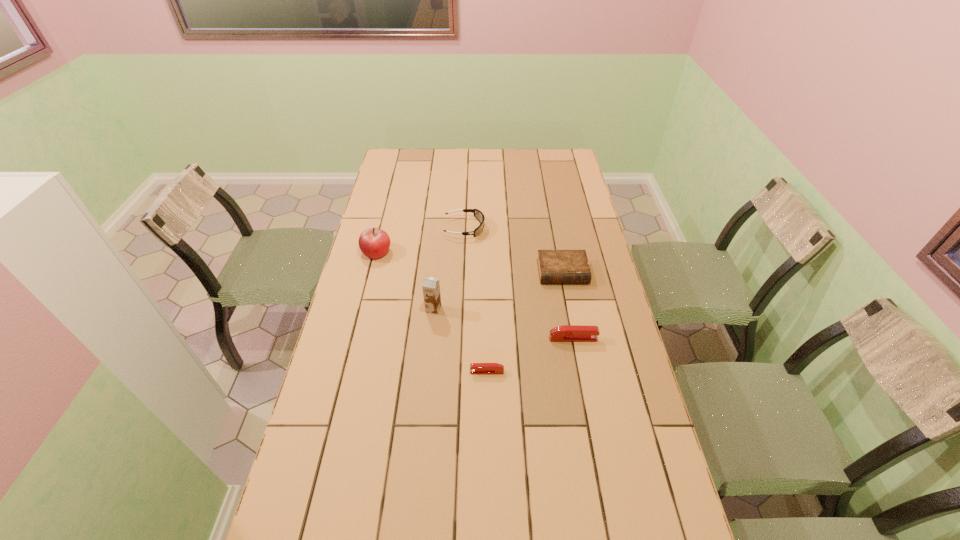
Image resolution: width=960 pixels, height=540 pixels. Find the location of `free space located 0.110m on the front-facing side of the nearer stapler`. free space located 0.110m on the front-facing side of the nearer stapler is located at coordinates coord(433,372).

The width and height of the screenshot is (960, 540). I want to click on vacant region located on the front-facing side of the nearer stapler, so click(399, 372).

The image size is (960, 540). Find the location of `free region located on the front-facing side of the nearer stapler`. free region located on the front-facing side of the nearer stapler is located at coordinates (444, 372).

Identify the location of free space located on the front-facing side of the farther stapler. (625, 339).

I want to click on blank space located 0.360m on the front and sides of the goggles, so click(573, 228).

Locate an element on the screen. The width and height of the screenshot is (960, 540). vacant space positioned 0.330m on the right of the third nearest object is located at coordinates (540, 309).

Where is `free space located on the spine side of the diary`? This screenshot has width=960, height=540. free space located on the spine side of the diary is located at coordinates pyautogui.click(x=571, y=318).

You are a GUI agent. You are given a task and a screenshot of the screen. Output one action in this format:
    pyautogui.click(x=<x>, y=<y>)
    Task: Click on the vacant space located 0.200m on the back of the leftmost object
    The width and height of the screenshot is (960, 540).
    Given the screenshot: What is the action you would take?
    pyautogui.click(x=387, y=211)

The width and height of the screenshot is (960, 540). Identify the location of object that is at the left edge. [374, 243].

This screenshot has width=960, height=540. Find the location of `stapler present at the right edge`. stapler present at the right edge is located at coordinates (567, 333).